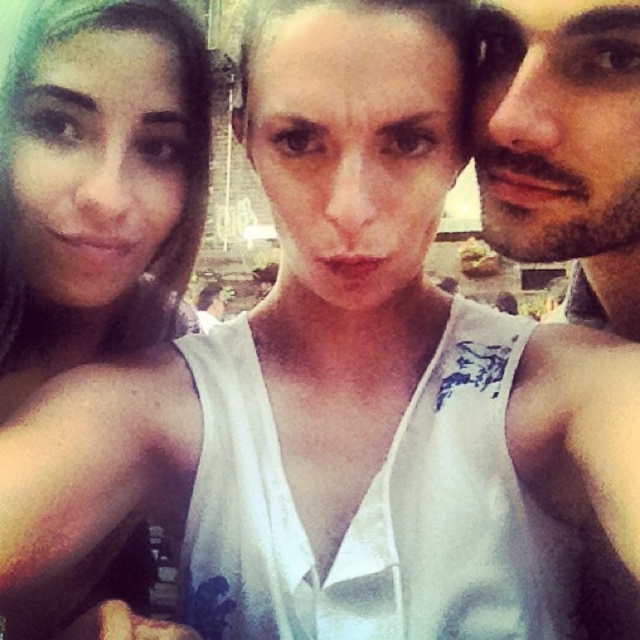
Between white fabric tank top at upper left and beardhairman at right, which one appears on the right side from the viewer's perspective?

Positioned to the right is beardhairman at right.

Can you confirm if white fabric tank top at upper left is shorter than beardhairman at right?

Incorrect, white fabric tank top at upper left's height does not fall short of beardhairman at right's.

The width and height of the screenshot is (640, 640). I want to click on white fabric tank top at upper left, so click(x=99, y=186).

Which is above, white fabric tank top at upper left or matte skin face at left?

matte skin face at left is higher up.

Is white fabric tank top at upper left to the right of matte skin face at left from the viewer's perspective?

In fact, white fabric tank top at upper left is to the left of matte skin face at left.

Who is more distant from viewer, (x=26, y=278) or (x=152, y=208)?

Positioned behind is point (x=26, y=278).

Locate an element on the screen. white fabric tank top at upper left is located at coordinates (99, 186).

How far apart are white matte face at center and matte skin face at left?

white matte face at center and matte skin face at left are 5.46 meters apart.

Consider the image. Who is shorter, white matte face at center or matte skin face at left?

matte skin face at left is shorter.

Between point (340, 170) and point (97, 272), which one is positioned in front?

Point (340, 170) is in front.

Locate an element on the screen. white matte face at center is located at coordinates (353, 144).